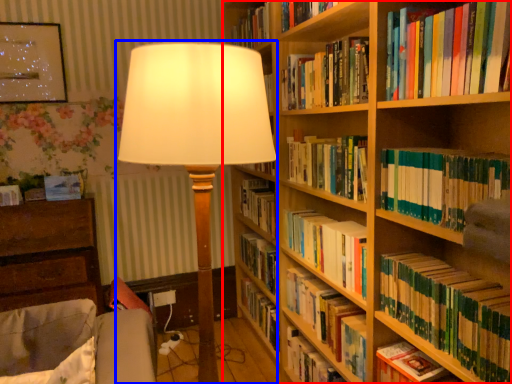
Question: Among these objects, which one is nearest to the camera, bookcase (highlighted by a red box) or lamp (highlighted by a blue box)?

Choices:
 (A) bookcase
 (B) lamp

Answer: (A)